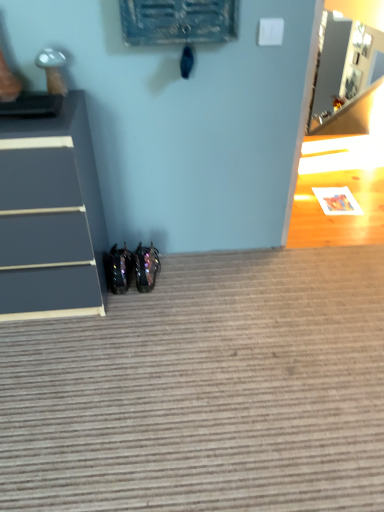
Where is `vacant space underneath glossy black shoes at lower center, which is the 2th footwear from right to left (from a real-world perspective)`? This screenshot has width=384, height=512. vacant space underneath glossy black shoes at lower center, which is the 2th footwear from right to left (from a real-world perspective) is located at coordinates (123, 283).